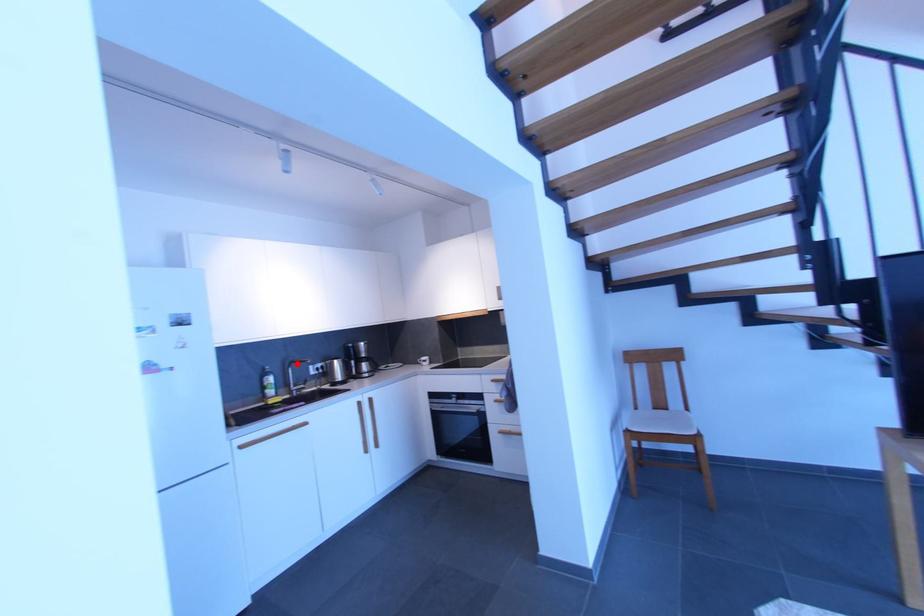
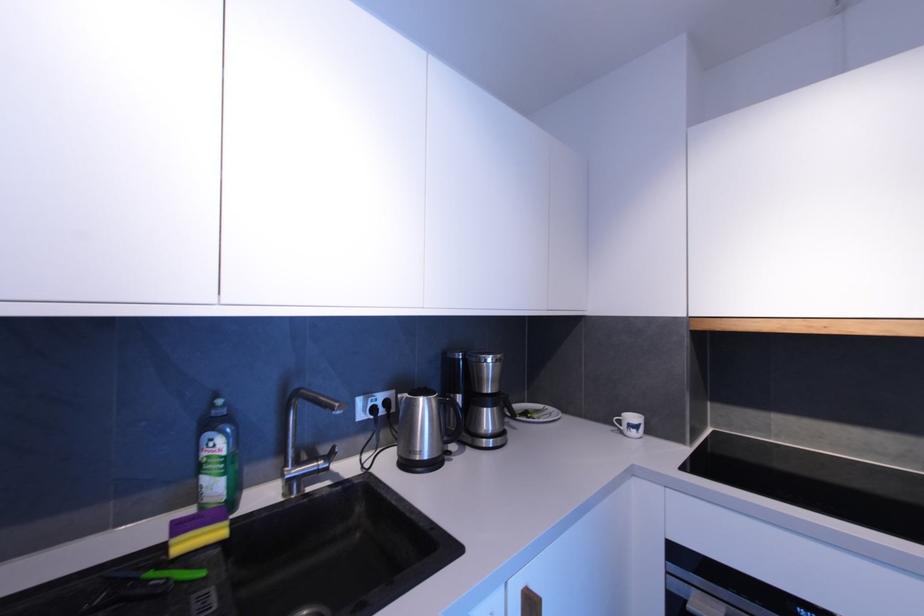
Locate, in the second image, the point that corresponds to the highlighted location in the first image.

(301, 395)